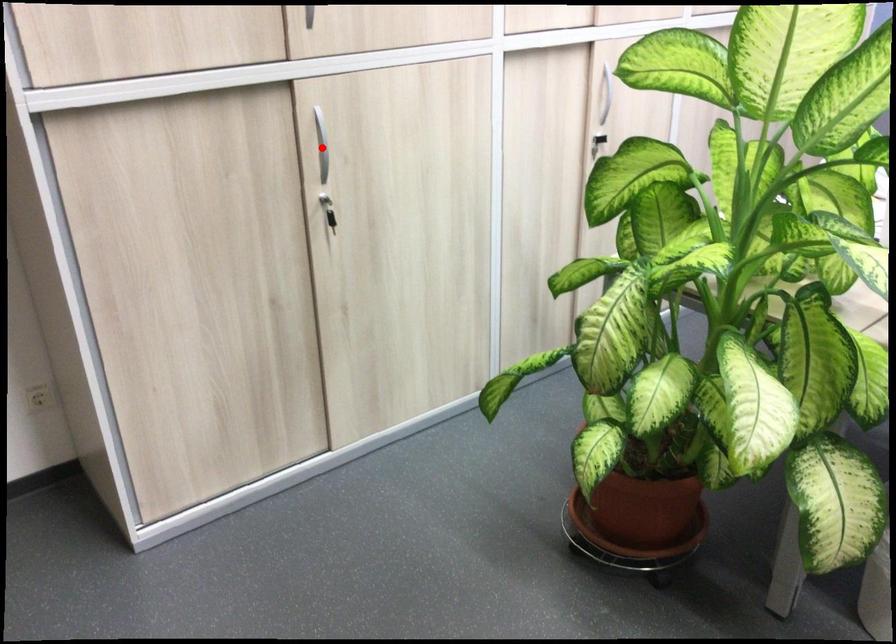
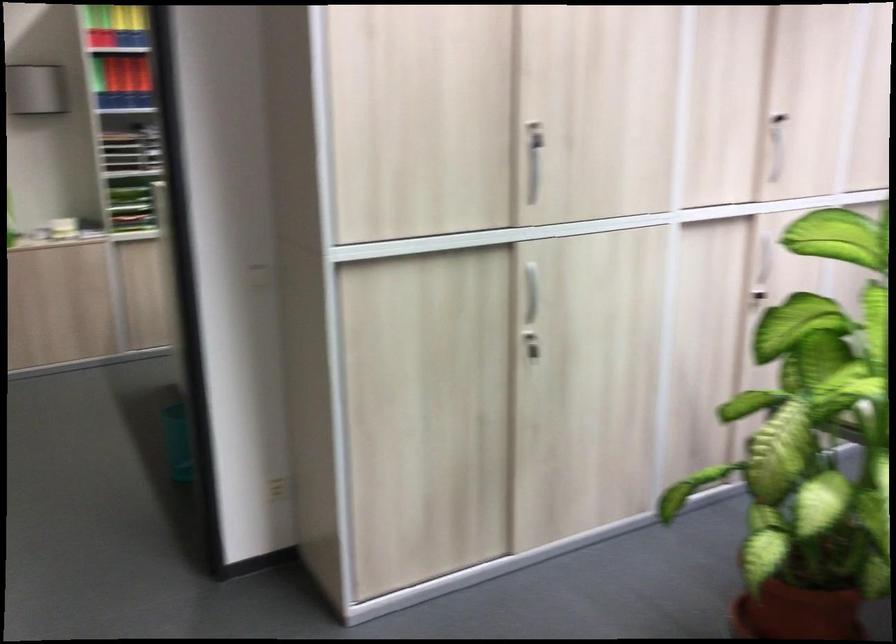
Locate, in the second image, the point that corresponds to the highlighted location in the first image.

(531, 292)